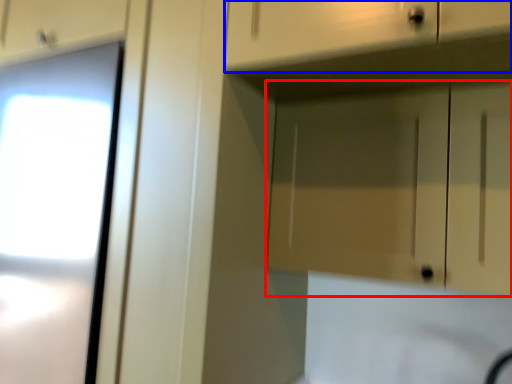
Question: Which point is further to the camera, cabinetry (highlighted by a red box) or drawer (highlighted by a blue box)?

Choices:
 (A) cabinetry
 (B) drawer

Answer: (A)